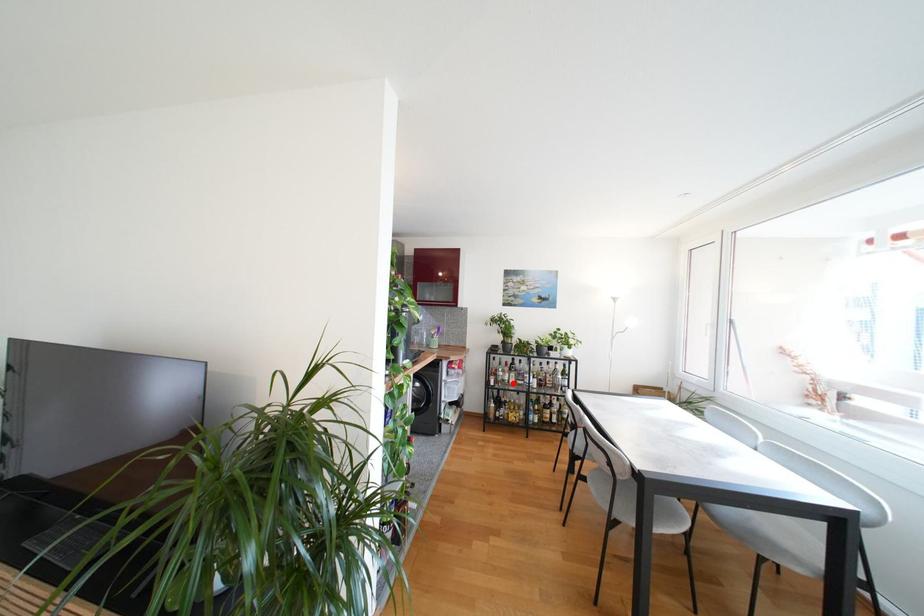
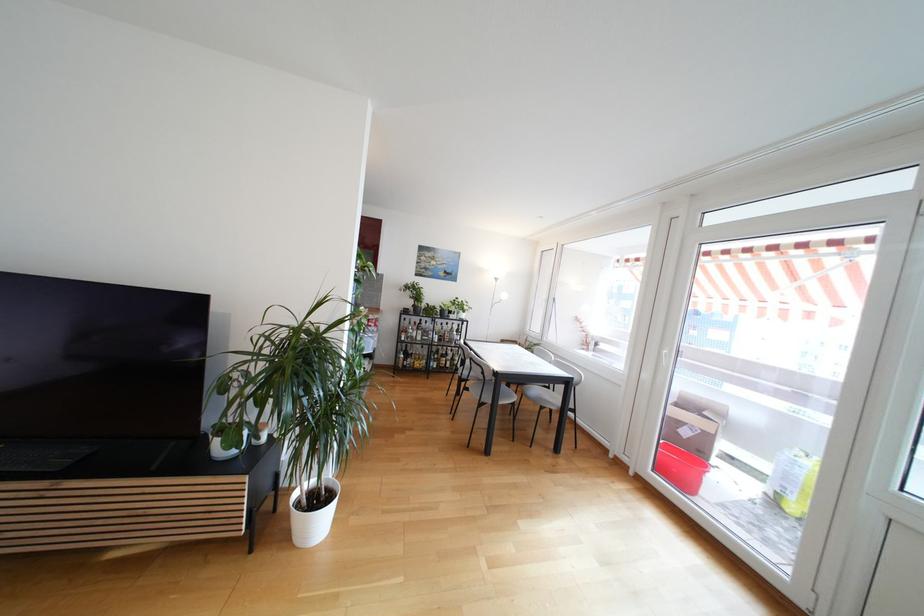
Question: I am providing you with two images of the same scene from different viewpoints. A red point is marked on the first image. Is the red point's position out of view in image 2?

Choices:
 (A) Yes
 (B) No

Answer: (B)